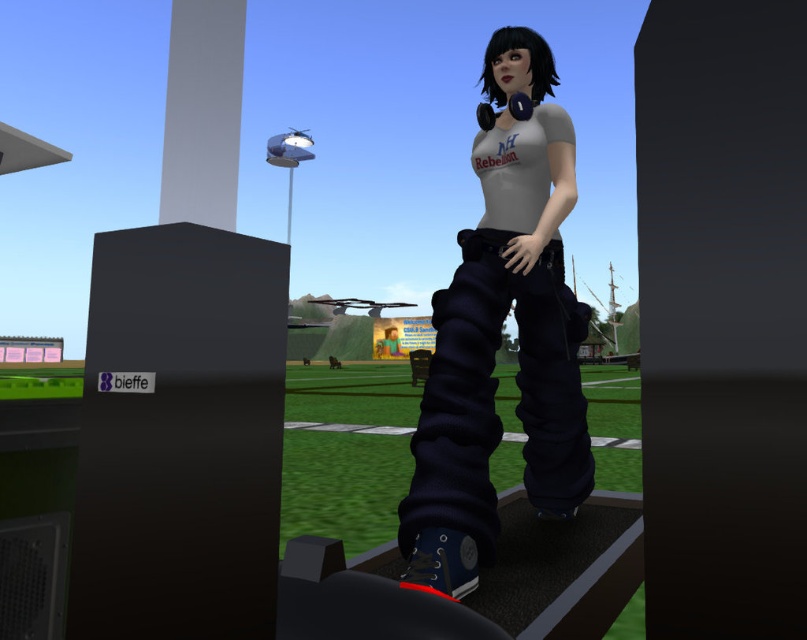
Is matte white t-shirt at center above smooth gray pillar at upper left?

No, matte white t-shirt at center is not above smooth gray pillar at upper left.

Is point (532, 416) closer to camera compared to point (226, 35)?

No, (532, 416) is further to viewer.

The image size is (807, 640). In order to click on matte white t-shirt at center in this screenshot , I will do `click(500, 337)`.

Who is more forward, (370, 444) or (241, 19)?

Point (241, 19) is in front.

Who is lower down, dark blue fabric football field at center or smooth gray pillar at upper left?

dark blue fabric football field at center is lower down.

Between point (320, 481) and point (174, 51), which one is positioned behind?

The point (320, 481) is behind.

Image resolution: width=807 pixels, height=640 pixels. What are the coordinates of `dark blue fabric football field at center` in the screenshot? It's located at (346, 451).

Who is taller, matte white t-shirt at center or dark blue fabric football field at center?

matte white t-shirt at center is taller.

Image resolution: width=807 pixels, height=640 pixels. Describe the element at coordinates (500, 337) in the screenshot. I see `matte white t-shirt at center` at that location.

Locate an element on the screen. matte white t-shirt at center is located at coordinates (500, 337).